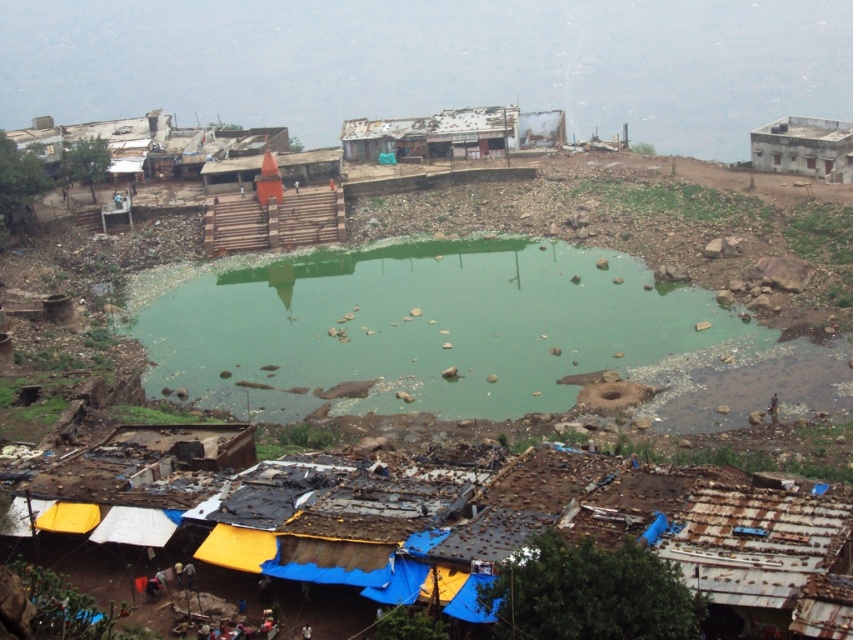
Question: Among these points, which one is nearest to the camera?

Choices:
 (A) (505, 360)
 (B) (819, 138)

Answer: (A)

Question: Does green murky water at center have a smaller size compared to white concrete building at upper right?

Choices:
 (A) yes
 (B) no

Answer: (B)

Question: Is green murky water at center to the right of white concrete building at upper right from the viewer's perspective?

Choices:
 (A) no
 (B) yes

Answer: (A)

Question: Does green murky water at center have a lesser width compared to white concrete building at upper right?

Choices:
 (A) no
 (B) yes

Answer: (A)

Question: Which object is closer to the camera taking this photo?

Choices:
 (A) green murky water at center
 (B) white concrete building at upper right

Answer: (A)